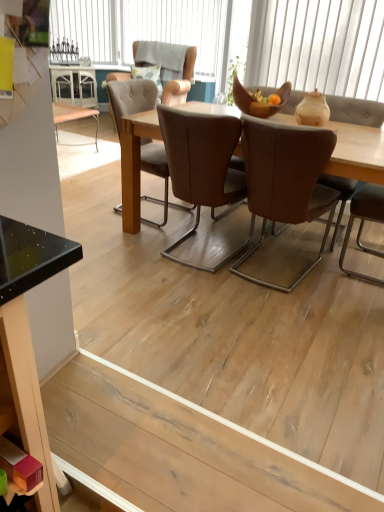
Question: From the image's perspective, is brown leather chair at center, placed as the second chair when sorted from back to front, above white textured cushion at upper center, acting as the second window starting from the top?

Choices:
 (A) yes
 (B) no

Answer: (B)

Question: From the image's perspective, does brown leather chair at center, which is the 2th chair from bottom to top, appear lower than white textured cushion at upper center, acting as the second window starting from the top?

Choices:
 (A) no
 (B) yes

Answer: (B)

Question: From a real-world perspective, is brown leather chair at center, placed as the second chair when sorted from back to front, positioned over white textured cushion at upper center, the 2th window positioned from the left, based on gravity?

Choices:
 (A) yes
 (B) no

Answer: (B)

Question: Is brown leather chair at center, the second chair from the top, further to the viewer compared to white textured cushion at upper center, the 2th window viewed from the front?

Choices:
 (A) no
 (B) yes

Answer: (A)

Question: Is brown leather chair at center, which is the 2th chair from bottom to top, at the left side of white textured cushion at upper center, the 2th window positioned from the left?

Choices:
 (A) yes
 (B) no

Answer: (B)

Question: Could you tell me if brown leather chair at center, which is the 2th chair from bottom to top, is turned towards white textured cushion at upper center, acting as the second window starting from the top?

Choices:
 (A) yes
 (B) no

Answer: (B)

Question: Does brown leather chair at center, the third chair from the top, have a lesser width compared to matte black desk at lower left?

Choices:
 (A) yes
 (B) no

Answer: (B)

Question: Is brown leather chair at center, the 1th chair from the front, not inside matte black desk at lower left?

Choices:
 (A) no
 (B) yes

Answer: (B)

Question: Considering the relative positions of brown leather chair at center, the third chair from the top, and matte black desk at lower left in the image provided, is brown leather chair at center, the third chair from the top, to the right of matte black desk at lower left from the viewer's perspective?

Choices:
 (A) no
 (B) yes

Answer: (B)

Question: Is the surface of brown leather chair at center, arranged as the first chair when ordered from the bottom, in direct contact with matte black desk at lower left?

Choices:
 (A) no
 (B) yes

Answer: (A)

Question: Does brown leather chair at center, the 1th chair from the front, turn towards matte black desk at lower left?

Choices:
 (A) yes
 (B) no

Answer: (B)

Question: Is brown leather chair at center, the third chair viewed from the back, taller than matte black desk at lower left?

Choices:
 (A) no
 (B) yes

Answer: (B)

Question: Is matte black desk at lower left aimed at light brown leather chair at upper center, which ranks as the first chair in back-to-front order?

Choices:
 (A) no
 (B) yes

Answer: (A)